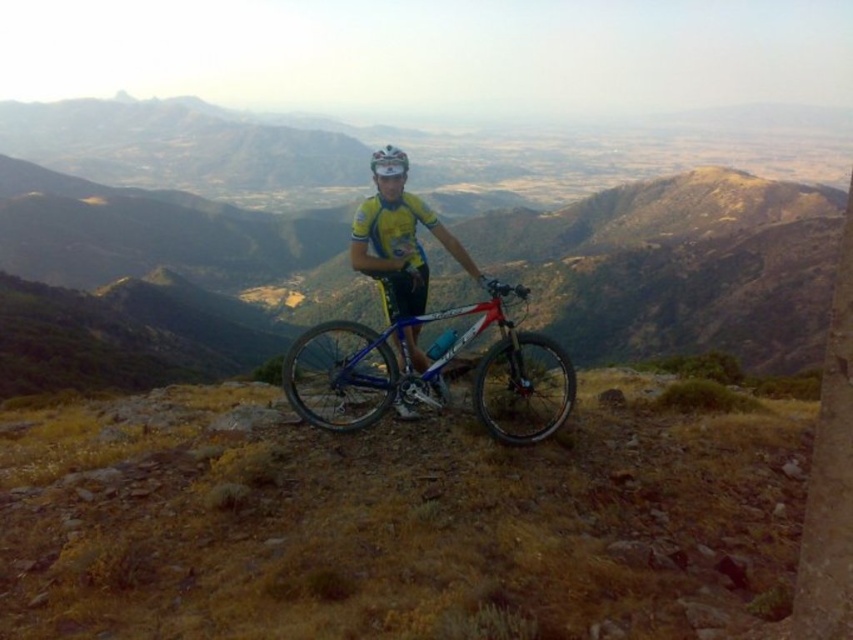
Does brown grassy terrain at center have a larger size compared to yellow jersey at center?

Incorrect, brown grassy terrain at center is not larger than yellow jersey at center.

Between brown grassy terrain at center and yellow jersey at center, which one has more height?

Standing taller between the two is yellow jersey at center.

This screenshot has height=640, width=853. What do you see at coordinates (396, 522) in the screenshot?
I see `brown grassy terrain at center` at bounding box center [396, 522].

Locate an element on the screen. brown grassy terrain at center is located at coordinates (396, 522).

Between blue metallic bicycle at center and yellow jersey at center, which one appears on the left side from the viewer's perspective?

From the viewer's perspective, blue metallic bicycle at center appears more on the left side.

Consider the image. Which of these two, blue metallic bicycle at center or yellow jersey at center, stands shorter?

Standing shorter between the two is blue metallic bicycle at center.

This screenshot has height=640, width=853. What are the coordinates of `blue metallic bicycle at center` in the screenshot? It's located at (419, 372).

Can you confirm if brown grassy terrain at center is bigger than white matte bicycle helmet at center?

No.

Does brown grassy terrain at center appear under white matte bicycle helmet at center?

Yes, brown grassy terrain at center is below white matte bicycle helmet at center.

Identify the location of brown grassy terrain at center. This screenshot has height=640, width=853. (396, 522).

Find the location of a particular element. brown grassy terrain at center is located at coordinates (396, 522).